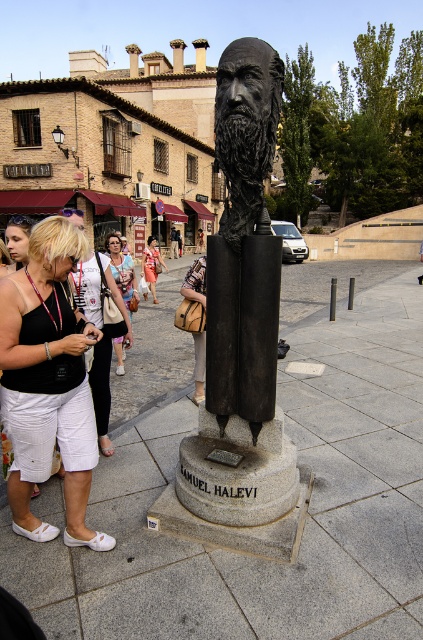
Question: Considering the relative positions of blonde hair woman at left and denim shorts at center in the image provided, where is blonde hair woman at left located with respect to denim shorts at center?

Choices:
 (A) above
 (B) below

Answer: (A)

Question: Based on their relative distances, which object is nearer to the matte black tank top at lower left?

Choices:
 (A) black polished stone bust at center
 (B) blonde hair woman at left

Answer: (A)

Question: Is black polished stone bust at center closer to camera compared to matte black tank top at lower left?

Choices:
 (A) no
 (B) yes

Answer: (A)

Question: Is leather brown bag at lower center below blonde hair at center?

Choices:
 (A) yes
 (B) no

Answer: (A)

Question: Which is nearer to the blonde hair at center?

Choices:
 (A) blonde hair woman at left
 (B) denim skirt at center
 (C) denim shorts at center

Answer: (A)

Question: Among these points, which one is farthest from the camera?

Choices:
 (A) 114,259
 (B) 8,436
 (C) 27,237
 (D) 85,298

Answer: (A)